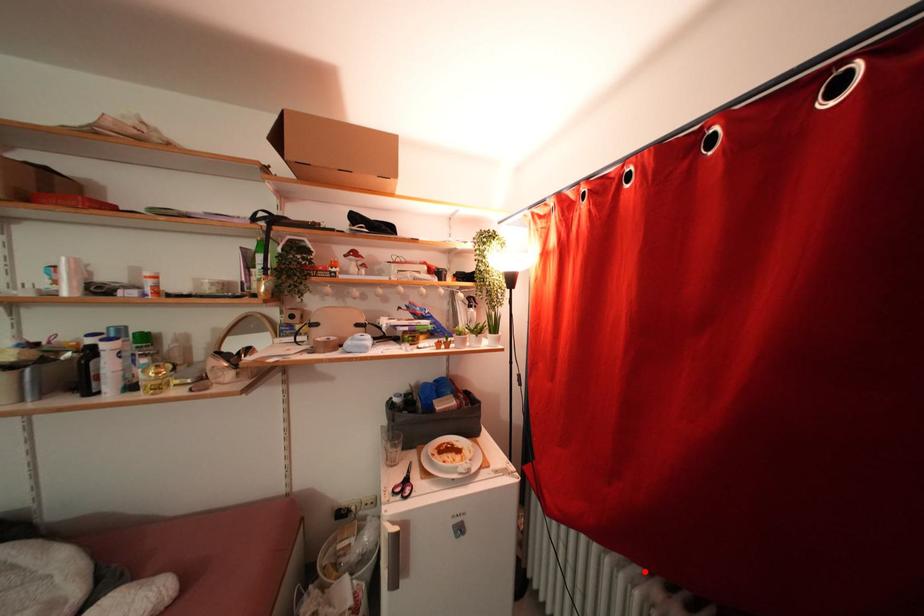
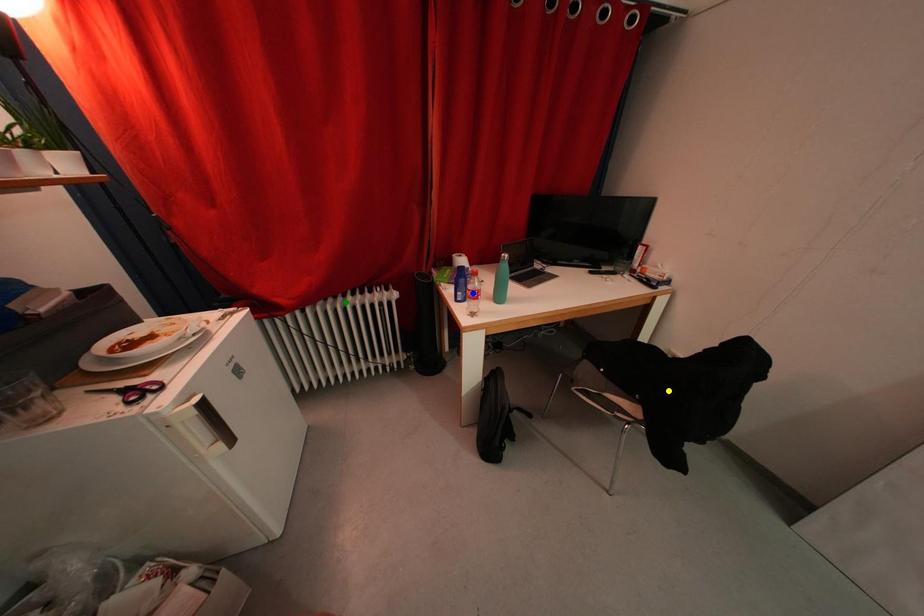
Question: I am providing you with two images of the same scene from different viewpoints. A red point is marked on the first image. You are given multiple points on the second image. Which spot in image 2 lines up with the point in image 1?

Choices:
 (A) green point
 (B) blue point
 (C) yellow point

Answer: (A)